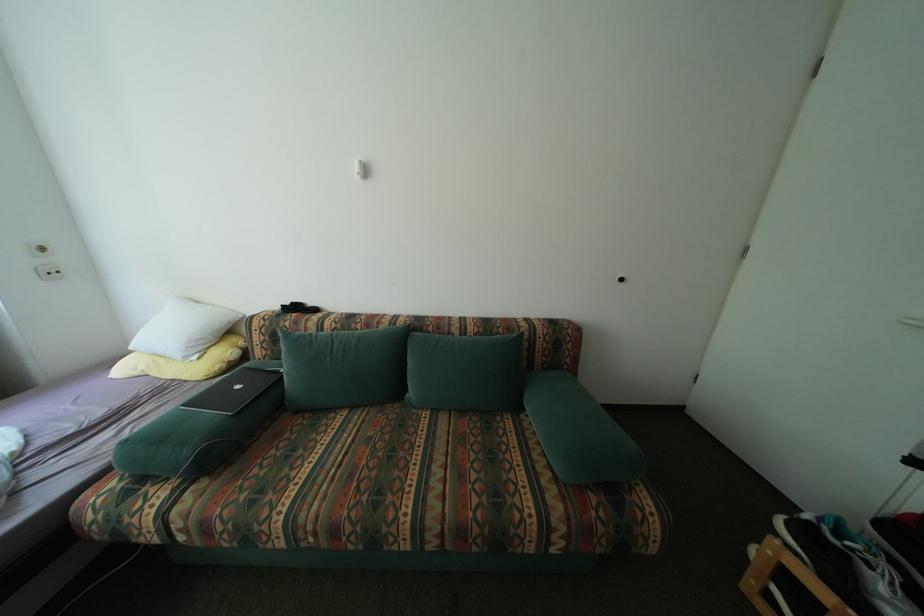
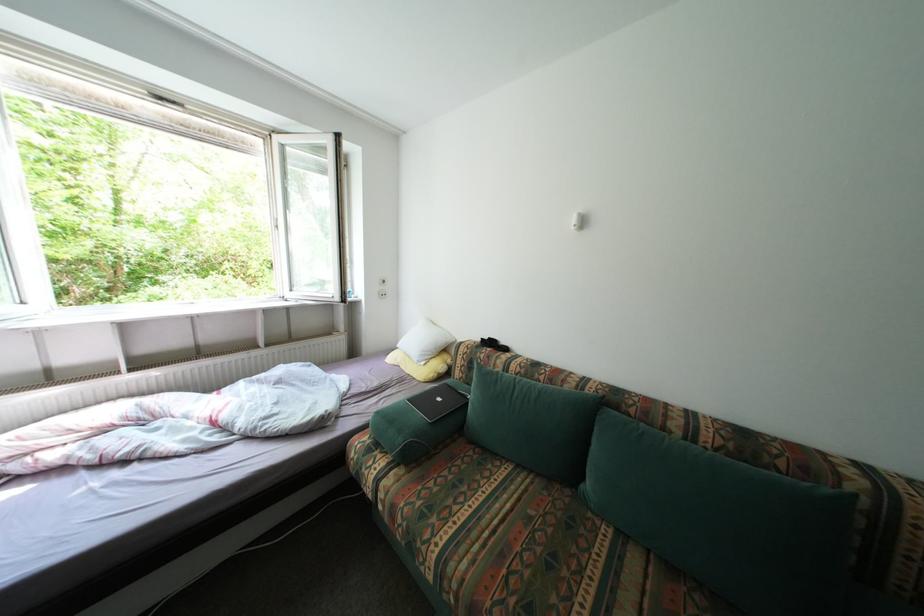
Question: How did the camera likely rotate?

Choices:
 (A) Left
 (B) Right
 (C) Up
 (D) Down

Answer: (A)